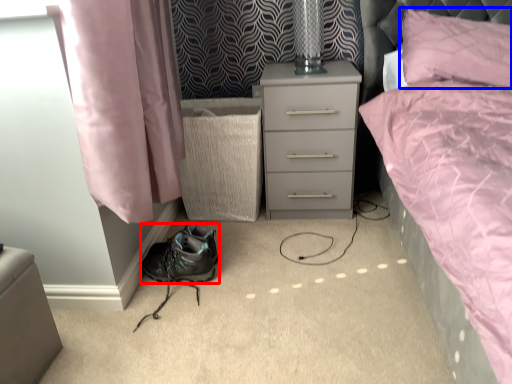
Question: Among these objects, which one is farthest to the camera, shoe (highlighted by a red box) or pillow (highlighted by a blue box)?

Choices:
 (A) shoe
 (B) pillow

Answer: (A)